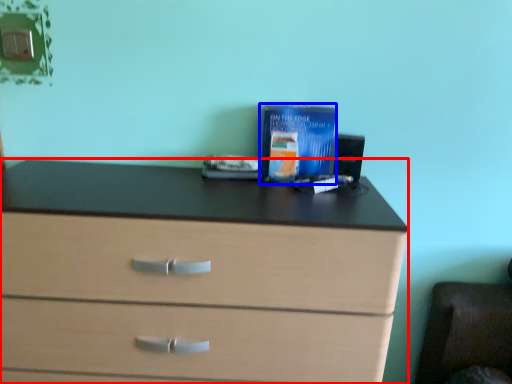
Question: Which of the following is the closest to the observer, chest of drawers (highlighted by a red box) or paperback book (highlighted by a blue box)?

Choices:
 (A) chest of drawers
 (B) paperback book

Answer: (A)